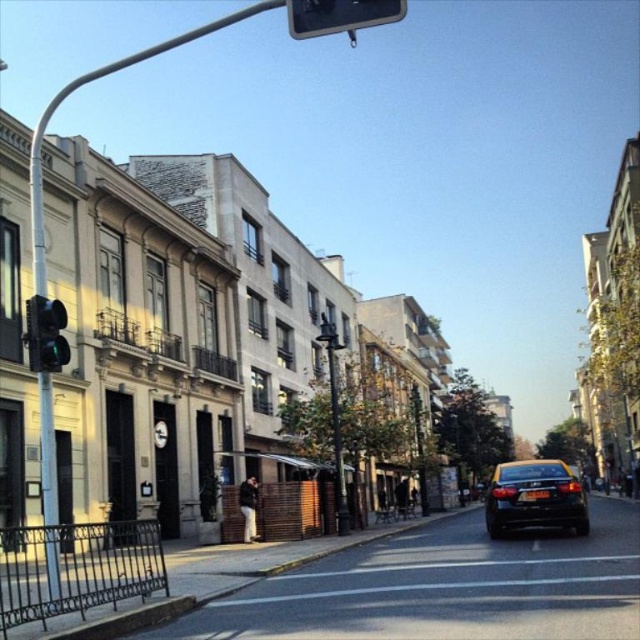
Question: Can you confirm if black glossy car at center is smaller than metallic rectangular sign at upper center?

Choices:
 (A) yes
 (B) no

Answer: (A)

Question: Which of the following is the closest to the observer?

Choices:
 (A) black glossy car at center
 (B) green glass traffic light at left
 (C) metallic rectangular sign at upper center

Answer: (C)

Question: Among these points, which one is farthest from the camera?

Choices:
 (A) (32, 301)
 (B) (304, 4)
 (C) (545, 476)

Answer: (C)

Question: Does black glossy car at center appear over metallic rectangular sign at upper center?

Choices:
 (A) no
 (B) yes

Answer: (A)

Question: Can you confirm if metallic rectangular sign at upper center is positioned to the right of green glass traffic light at left?

Choices:
 (A) no
 (B) yes

Answer: (B)

Question: Which point is farther from the camera taking this photo?

Choices:
 (A) (317, 26)
 (B) (45, 330)

Answer: (B)